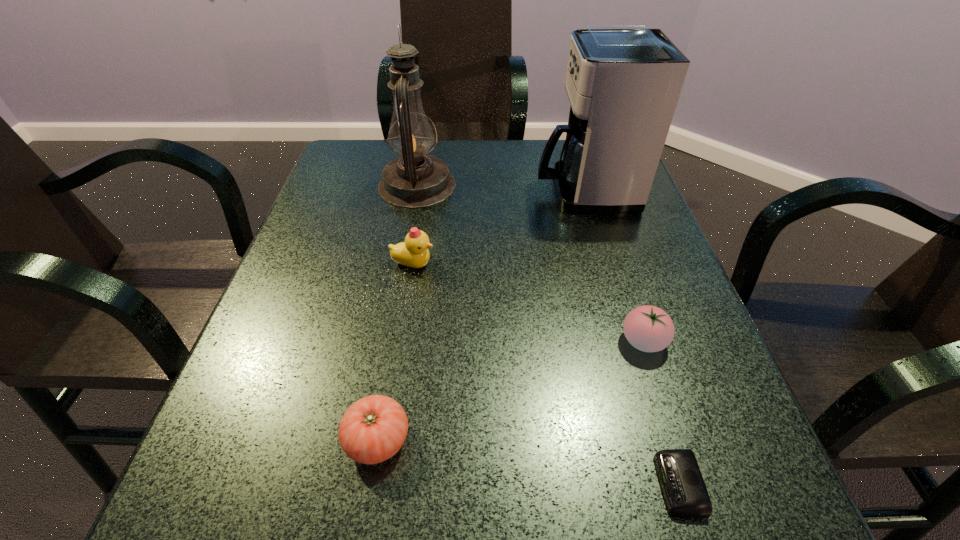
Where is `tomato that is at the near edge`? tomato that is at the near edge is located at coordinates (373, 429).

Find the location of `alarm clock that is at the near edge`. alarm clock that is at the near edge is located at coordinates (685, 493).

Image resolution: width=960 pixels, height=540 pixels. Identify the location of object present at the left edge. (416, 180).

Locate an element on the screen. Image resolution: width=960 pixels, height=540 pixels. coffee maker that is at the right edge is located at coordinates (623, 82).

In order to click on tomato that is positioned at the right edge in this screenshot , I will do `click(648, 328)`.

The width and height of the screenshot is (960, 540). Find the location of `alarm clock that is at the right edge`. alarm clock that is at the right edge is located at coordinates (685, 493).

You are a GUI agent. You are given a task and a screenshot of the screen. Output one action in this format:
    pyautogui.click(x=<x>, y=<y>)
    Task: Click on the object positioned at the far left corner
    
    Given the screenshot: What is the action you would take?
    pyautogui.click(x=416, y=180)

The image size is (960, 540). Find the location of `object positioned at the far right corner`. object positioned at the far right corner is located at coordinates (623, 82).

Identify the location of object that is positioned at the near right corner. This screenshot has height=540, width=960. (685, 493).

In order to click on vacant space at the far edge in this screenshot , I will do `click(492, 159)`.